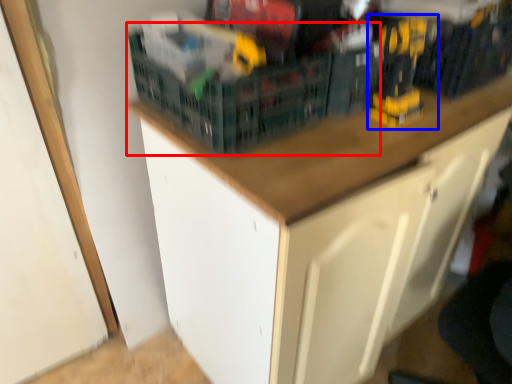
Question: Which object appears closest to the camera in this image, basket (highlighted by a red box) or toy (highlighted by a blue box)?

Choices:
 (A) basket
 (B) toy

Answer: (A)